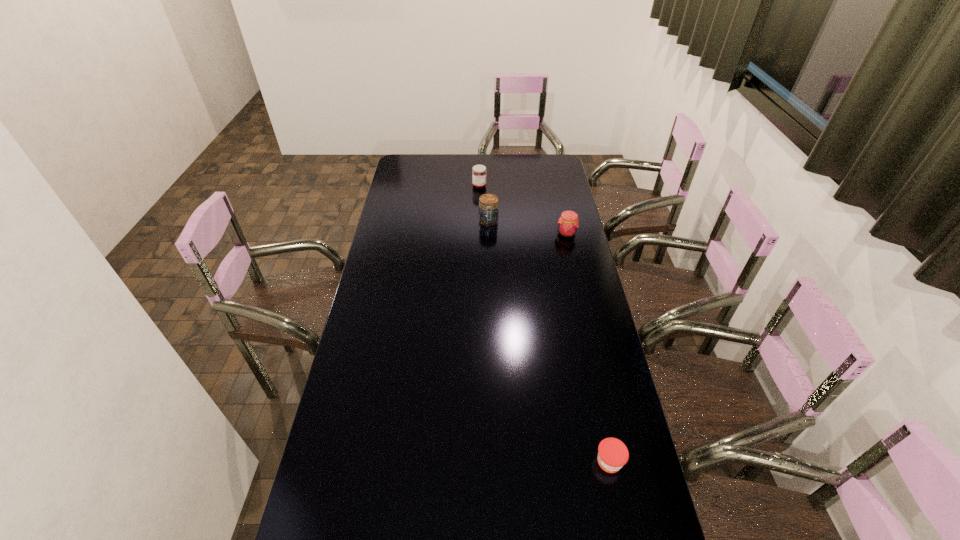
Image resolution: width=960 pixels, height=540 pixels. Find the location of `free space at the far edge of the desktop`. free space at the far edge of the desktop is located at coordinates (454, 161).

Where is `free space at the left edge of the desktop`? The image size is (960, 540). free space at the left edge of the desktop is located at coordinates (401, 272).

In the image, there is a desktop. Where is `free space at the right edge`? The width and height of the screenshot is (960, 540). free space at the right edge is located at coordinates (607, 397).

Identify the location of free space at the far right corner of the desktop. The height and width of the screenshot is (540, 960). (551, 170).

The image size is (960, 540). I want to click on free point between the farthest object and the shortest jam, so point(544,324).

Find the location of a particular element. The width and height of the screenshot is (960, 540). vacant area that lies between the shortest object and the second nearest jam is located at coordinates (588, 348).

This screenshot has width=960, height=540. I want to click on vacant point located between the jar and the shortest jam, so click(x=549, y=341).

Where is `free space between the farthest object and the shortest jam`? free space between the farthest object and the shortest jam is located at coordinates (544, 324).

Locate an element on the screen. This screenshot has height=540, width=960. vacant area between the farthest object and the second nearest jam is located at coordinates (523, 210).

Image resolution: width=960 pixels, height=540 pixels. Find the location of `free space between the shortest jam and the leftmost jam`. free space between the shortest jam and the leftmost jam is located at coordinates (544, 324).